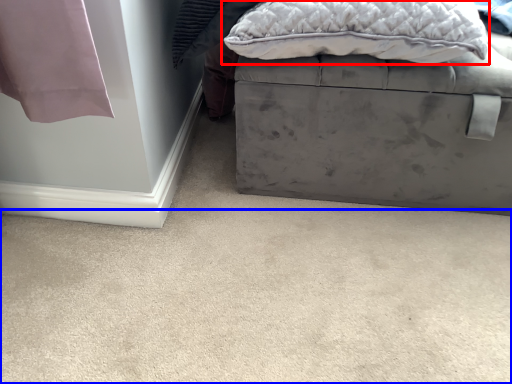
Question: Which object is closer to the camera taking this photo, pillow (highlighted by a red box) or concrete (highlighted by a blue box)?

Choices:
 (A) pillow
 (B) concrete

Answer: (B)